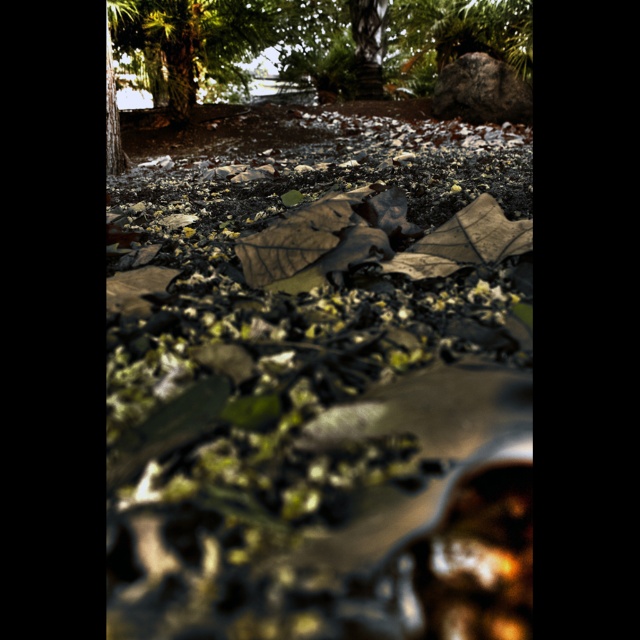
You are a photographer aiming to capture the brown leaf litter at center and the green leafy tree at upper left in a single frame. Based on their heights, which object will appear smaller in the photo?

The brown leaf litter at center will appear smaller in the photo because it has a lesser height compared to the green leafy tree at upper left.